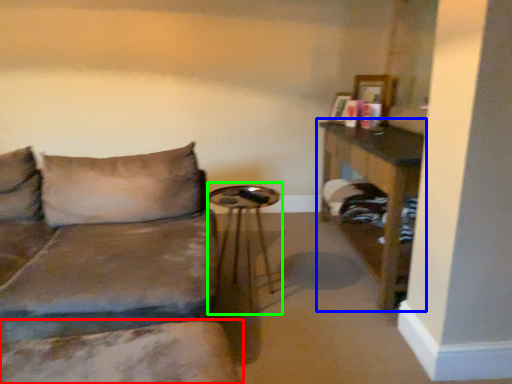
Question: Estimate the real-world distances between objects in this image. Which object is closer to swivel chair (highlighted by a red box), table (highlighted by a blue box) or side table (highlighted by a green box)?

Choices:
 (A) table
 (B) side table

Answer: (B)